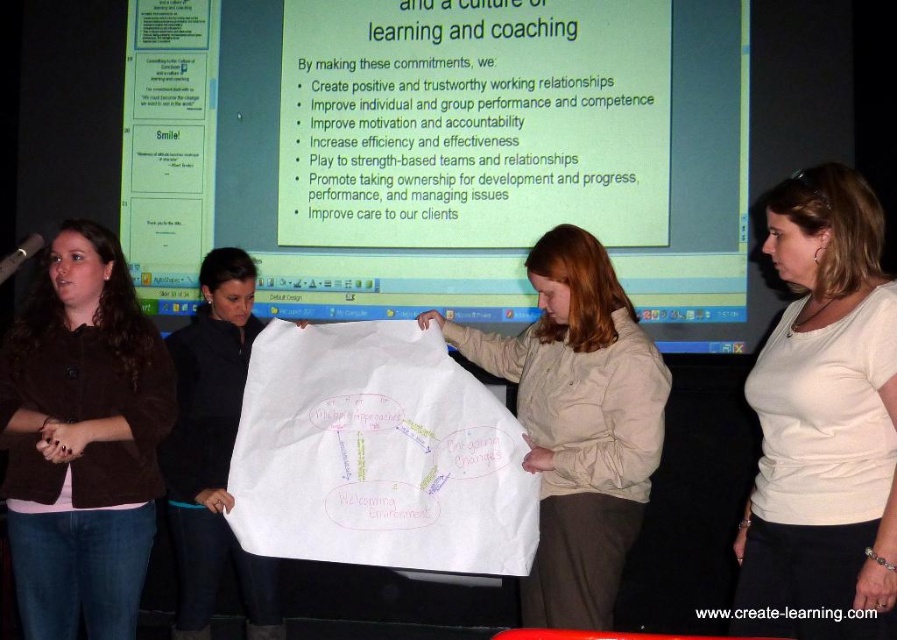
Is white cotton shirt at center positioned behind brown fabric jacket at left?

That is False.

Who is positioned more to the left, white cotton shirt at center or brown fabric jacket at left?

Positioned to the left is brown fabric jacket at left.

Measure the distance between point (825, 500) and camera.

Point (825, 500) and camera are 2.36 meters apart from each other.

This screenshot has height=640, width=897. I want to click on white cotton shirt at center, so click(823, 419).

Who is shorter, brown fabric jacket at left or beige fabric paper at center?

beige fabric paper at center

Is point (76, 440) positioned before point (585, 536)?

Yes, point (76, 440) is closer to viewer.

What are the coordinates of `brown fabric jacket at left` in the screenshot? It's located at (83, 440).

Does white cotton shirt at center lie behind beige fabric paper at center?

No, white cotton shirt at center is closer to the viewer.

Is point (858, 192) positioned before point (631, 424)?

That is True.

What are the coordinates of `white cotton shirt at center` in the screenshot? It's located at (823, 419).